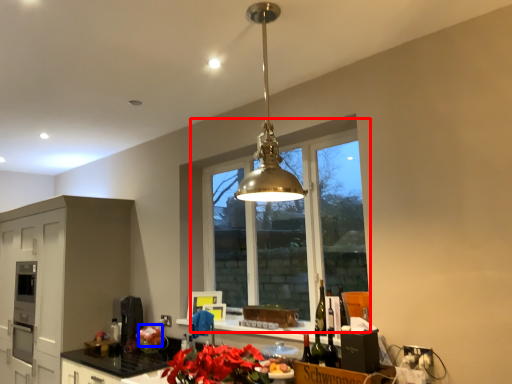
Question: Which of the following is the closest to the observer, window (highlighted by a red box) or flower (highlighted by a blue box)?

Choices:
 (A) window
 (B) flower

Answer: (A)